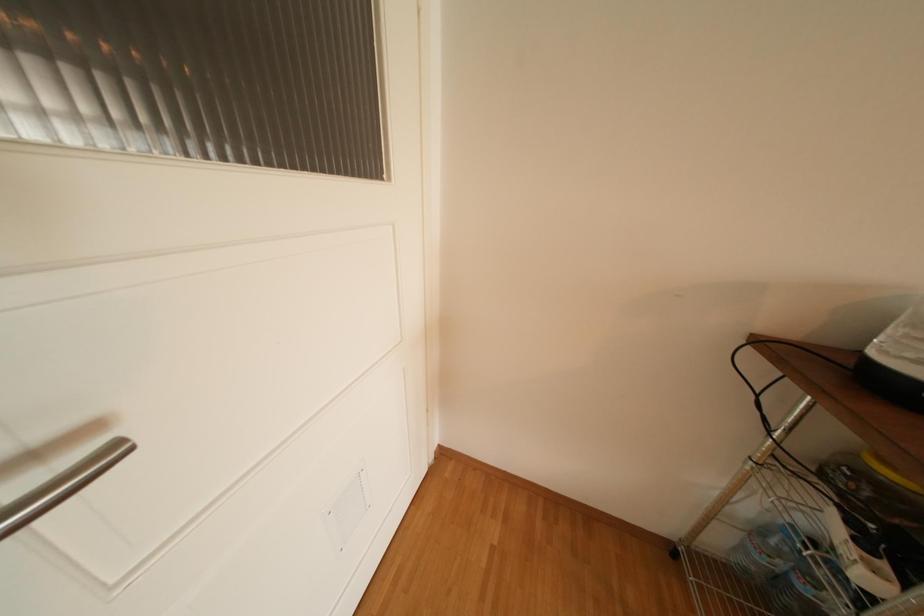
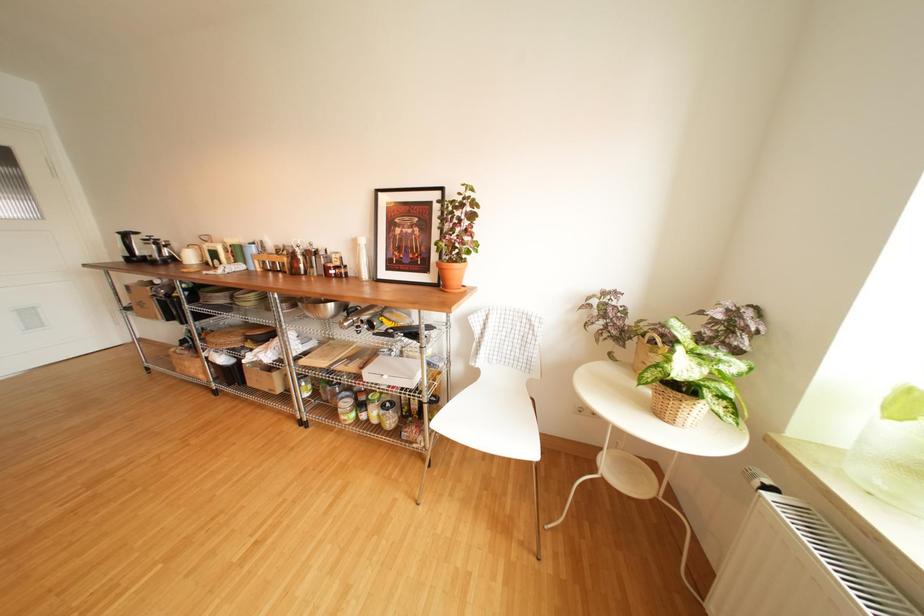
The images are taken continuously from a first-person perspective. In which direction are you moving?

The cameraman moved toward right, backward.